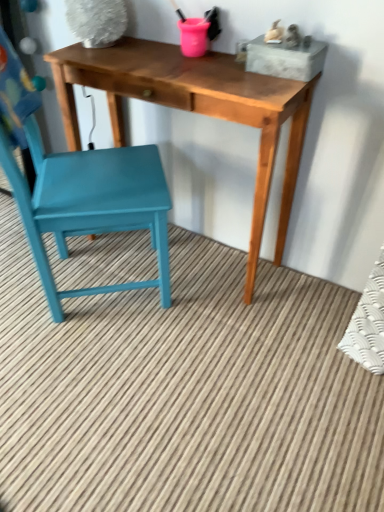
This screenshot has width=384, height=512. I want to click on vacant location below teal painted wood chair at left (from a real-world perspective), so click(98, 278).